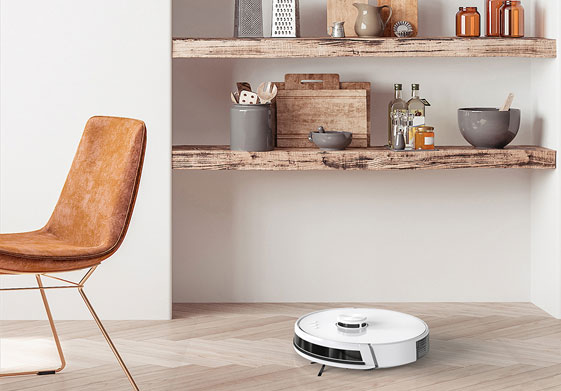
This screenshot has width=561, height=391. What are the coordinates of `bowl` in the screenshot? It's located at (478, 129).